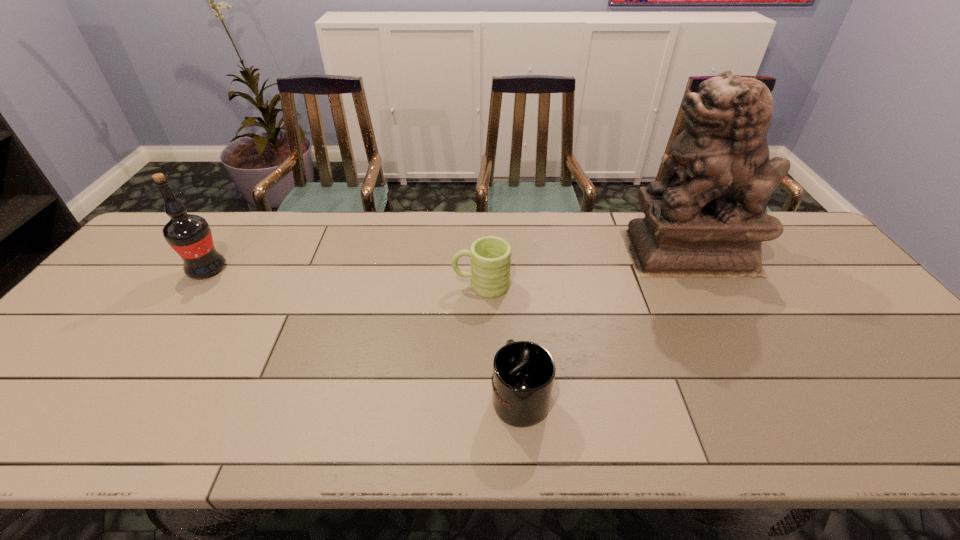
Image resolution: width=960 pixels, height=540 pixels. In order to click on vacant space in between the nearest object and the third shortest object in this screenshot , I will do `click(363, 332)`.

Identify which object is located as the second nearest to the third shortest object. Please provide its 2D coordinates. Your answer should be formatted as a tuple, i.e. [(x, y)], where the tuple contains the x and y coordinates of a point satisfying the conditions above.

[(523, 375)]

Choose which object is the third nearest neighbor to the nearest object. Please provide its 2D coordinates. Your answer should be formatted as a tuple, i.e. [(x, y)], where the tuple contains the x and y coordinates of a point satisfying the conditions above.

[(189, 235)]

You are a GUI agent. You are given a task and a screenshot of the screen. Output one action in this format:
    pyautogui.click(x=<x>, y=<y>)
    Task: Click on the free location that satisfies the following two spatial constraints: 1. on the side of the farther mug with the handle; 2. with the handle on the side of the nearer mug
    The height and width of the screenshot is (540, 960).
    Given the screenshot: What is the action you would take?
    pyautogui.click(x=482, y=395)

Identify the location of vacant space that satisfies the following two spatial constraints: 1. with the handle on the side of the nearer mug; 2. on the side of the farther mug with the handle. This screenshot has width=960, height=540. (511, 285).

Find the location of a particular element. The height and width of the screenshot is (540, 960). vacant area that satisfies the following two spatial constraints: 1. on the side of the farther mug with the handle; 2. with the handle on the side of the nearest object is located at coordinates (482, 395).

The image size is (960, 540). What are the coordinates of `vacant space that satisfies the following two spatial constraints: 1. on the side of the farther mug with the handle; 2. with the handle on the side of the nearest object` in the screenshot? It's located at (482, 395).

Where is `vacant region that satisfies the following two spatial constraints: 1. on the front-facing side of the rightmost object; 2. on the front side of the second tallest object`? The image size is (960, 540). vacant region that satisfies the following two spatial constraints: 1. on the front-facing side of the rightmost object; 2. on the front side of the second tallest object is located at coordinates (698, 269).

The width and height of the screenshot is (960, 540). Find the location of `vacant space that satisfies the following two spatial constraints: 1. on the side of the farther mug with the handle; 2. with the handle on the side of the nearest object`. vacant space that satisfies the following two spatial constraints: 1. on the side of the farther mug with the handle; 2. with the handle on the side of the nearest object is located at coordinates (482, 395).